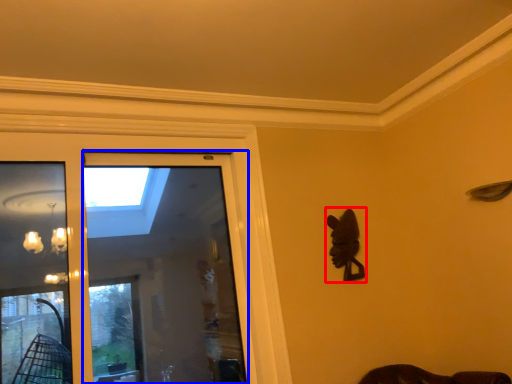
Question: Which of the following is the farthest to the observer, animal (highlighted by a red box) or screen door (highlighted by a blue box)?

Choices:
 (A) animal
 (B) screen door

Answer: (A)